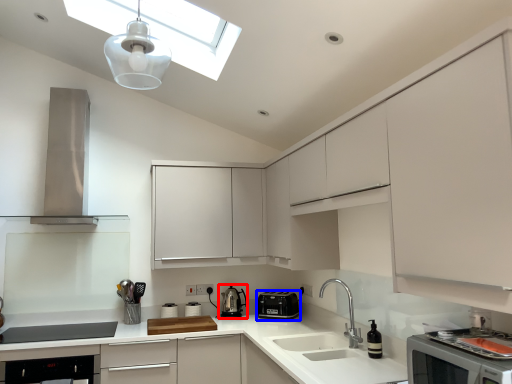
Question: Which point is further to the camera, kitchen appliance (highlighted by a red box) or kitchen appliance (highlighted by a blue box)?

Choices:
 (A) kitchen appliance
 (B) kitchen appliance

Answer: (A)